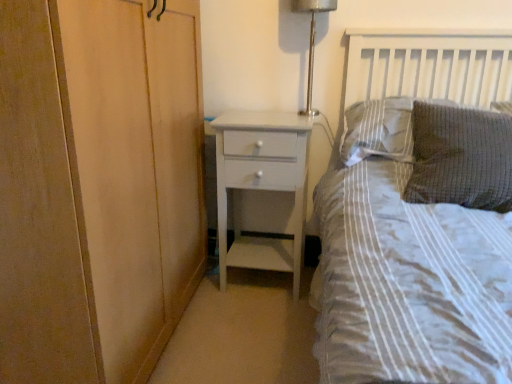
Identify the location of metallic silver lamp at upper right. The height and width of the screenshot is (384, 512). (312, 41).

Measure the distance between metallic silver lamp at upper right and camera.

metallic silver lamp at upper right and camera are 5.50 feet apart from each other.

Describe the element at coordinates (378, 130) in the screenshot. The width and height of the screenshot is (512, 384). I see `gray textured pillow at upper right, which is the first pillow from back to front` at that location.

Locate an element on the screen. metallic silver lamp at upper right is located at coordinates (312, 41).

Which is less distant, (308, 112) or (459, 153)?

Point (308, 112) is farther from the camera than point (459, 153).

Based on the photo, does metallic silver lamp at upper right come behind textured gray pillow at upper right, which is the first pillow in front-to-back order?

Yes, metallic silver lamp at upper right is behind textured gray pillow at upper right, which is the first pillow in front-to-back order.

Is metallic silver lamp at upper right facing away from textured gray pillow at upper right, which is the first pillow in front-to-back order?

No, metallic silver lamp at upper right is not facing away from textured gray pillow at upper right, which is the first pillow in front-to-back order.

Can you tell me how much metallic silver lamp at upper right and textured gray pillow at upper right, which is the first pillow in front-to-back order, differ in facing direction?

There is a 8.53-degree angle between the facing directions of metallic silver lamp at upper right and textured gray pillow at upper right, which is the first pillow in front-to-back order.

Is metallic silver lamp at upper right not close to gray textured pillow at upper right, marked as the 2th pillow in a front-to-back arrangement?

They are positioned close to each other.

Does point (307, 0) come farther from viewer compared to point (364, 106)?

Yes, point (307, 0) is behind point (364, 106).

In the scene shown: Is metallic silver lamp at upper right positioned with its back to gray textured pillow at upper right, which is the first pillow from back to front?

No, metallic silver lamp at upper right is not facing the opposite direction of gray textured pillow at upper right, which is the first pillow from back to front.

Is gray textured pillow at upper right, which is the first pillow from back to front, a part of metallic silver lamp at upper right?

No, gray textured pillow at upper right, which is the first pillow from back to front, is not inside metallic silver lamp at upper right.

Is gray textured pillow at upper right, which is the first pillow from back to front, inside or outside of metallic silver lamp at upper right?

gray textured pillow at upper right, which is the first pillow from back to front, lies outside metallic silver lamp at upper right.

From the image's perspective, is gray textured pillow at upper right, which is the first pillow from back to front, below metallic silver lamp at upper right?

Yes, from the image's perspective, gray textured pillow at upper right, which is the first pillow from back to front, is beneath metallic silver lamp at upper right.

Image resolution: width=512 pixels, height=384 pixels. I want to click on the 1st pillow below the metallic silver lamp at upper right (from a real-world perspective), so click(x=378, y=130).

From a real-world perspective, is white painted wood chest of drawers at center located higher than metallic silver lamp at upper right?

No, from a real-world perspective, white painted wood chest of drawers at center is not above metallic silver lamp at upper right.

Measure the distance between white painted wood chest of drawers at center and metallic silver lamp at upper right.

white painted wood chest of drawers at center is 17.68 inches away from metallic silver lamp at upper right.

Based on the photo, which object is thinner, white painted wood chest of drawers at center or metallic silver lamp at upper right?

metallic silver lamp at upper right.

Is white painted wood chest of drawers at center to the right of metallic silver lamp at upper right from the viewer's perspective?

No, white painted wood chest of drawers at center is not to the right of metallic silver lamp at upper right.

From the picture: Considering the positions of objects textured gray pillow at upper right, the second pillow from the back, and white painted wood chest of drawers at center in the image provided, who is more to the right, textured gray pillow at upper right, the second pillow from the back, or white painted wood chest of drawers at center?

textured gray pillow at upper right, the second pillow from the back, is more to the right.

In the scene shown: Can you confirm if textured gray pillow at upper right, the second pillow from the back, is shorter than white painted wood chest of drawers at center?

Yes.

From a real-world perspective, is textured gray pillow at upper right, which is the first pillow in front-to-back order, positioned over white painted wood chest of drawers at center based on gravity?

Yes, from a real-world perspective, textured gray pillow at upper right, which is the first pillow in front-to-back order, is above white painted wood chest of drawers at center.

Is textured gray pillow at upper right, which is the first pillow in front-to-back order, thinner than white painted wood chest of drawers at center?

No, textured gray pillow at upper right, which is the first pillow in front-to-back order, is not thinner than white painted wood chest of drawers at center.

Based on the photo, considering the sizes of objects white painted wood chest of drawers at center and gray textured pillow at upper right, which is the first pillow from back to front, in the image provided, who is taller, white painted wood chest of drawers at center or gray textured pillow at upper right, which is the first pillow from back to front,?

Standing taller between the two is white painted wood chest of drawers at center.

Is there a large distance between white painted wood chest of drawers at center and gray textured pillow at upper right, which is the first pillow from back to front?

white painted wood chest of drawers at center is actually quite close to gray textured pillow at upper right, which is the first pillow from back to front.

Locate an element on the screen. The height and width of the screenshot is (384, 512). chest of drawers located on the left of gray textured pillow at upper right, which is the first pillow from back to front is located at coordinates (261, 185).

Is gray textured pillow at upper right, marked as the 2th pillow in a front-to-back arrangement, a part of white painted wood chest of drawers at center?

That's incorrect, gray textured pillow at upper right, marked as the 2th pillow in a front-to-back arrangement, is not inside white painted wood chest of drawers at center.

Could you tell me if textured gray pillow at upper right, which is the first pillow in front-to-back order, is facing gray textured pillow at upper right, which is the first pillow from back to front?

No, textured gray pillow at upper right, which is the first pillow in front-to-back order, is not turned towards gray textured pillow at upper right, which is the first pillow from back to front.

Does textured gray pillow at upper right, which is the first pillow in front-to-back order, have a lesser width compared to gray textured pillow at upper right, marked as the 2th pillow in a front-to-back arrangement?

Incorrect, the width of textured gray pillow at upper right, which is the first pillow in front-to-back order, is not less than that of gray textured pillow at upper right, marked as the 2th pillow in a front-to-back arrangement.

Image resolution: width=512 pixels, height=384 pixels. I want to click on pillow on the left of the textured gray pillow at upper right, which is the first pillow in front-to-back order, so tap(378, 130).

At what (x,y) coordinates should I click in order to perform the action: click on bedside lamp above the textured gray pillow at upper right, the second pillow from the back (from the image's perspective). Please return your answer as a coordinate pair (x, y). This screenshot has height=384, width=512. Looking at the image, I should click on (312, 41).

Image resolution: width=512 pixels, height=384 pixels. I want to click on bedside lamp that is above the gray textured pillow at upper right, marked as the 2th pillow in a front-to-back arrangement (from a real-world perspective), so click(312, 41).

When comparing their distances from textured gray pillow at upper right, which is the first pillow in front-to-back order, does metallic silver lamp at upper right or white painted wood chest of drawers at center seem further?

metallic silver lamp at upper right.

From the image, which object appears to be nearer to textured gray pillow at upper right, the second pillow from the back, metallic silver lamp at upper right or gray textured pillow at upper right, marked as the 2th pillow in a front-to-back arrangement?

gray textured pillow at upper right, marked as the 2th pillow in a front-to-back arrangement, is positioned closer to the anchor textured gray pillow at upper right, the second pillow from the back.

From the image, which object appears to be farther from white painted wood chest of drawers at center, textured gray pillow at upper right, which is the first pillow in front-to-back order, or metallic silver lamp at upper right?

Based on the image, textured gray pillow at upper right, which is the first pillow in front-to-back order, appears to be further to white painted wood chest of drawers at center.

From the image, which object appears to be farther from gray textured pillow at upper right, marked as the 2th pillow in a front-to-back arrangement, white painted wood chest of drawers at center or textured gray pillow at upper right, which is the first pillow in front-to-back order?

white painted wood chest of drawers at center is positioned further to the anchor gray textured pillow at upper right, marked as the 2th pillow in a front-to-back arrangement.

Looking at the image, which one is located closer to white painted wood chest of drawers at center, gray textured pillow at upper right, which is the first pillow from back to front, or metallic silver lamp at upper right?

Based on the image, gray textured pillow at upper right, which is the first pillow from back to front, appears to be nearer to white painted wood chest of drawers at center.

When comparing their distances from textured gray pillow at upper right, the second pillow from the back, does gray textured pillow at upper right, marked as the 2th pillow in a front-to-back arrangement, or metallic silver lamp at upper right seem closer?

gray textured pillow at upper right, marked as the 2th pillow in a front-to-back arrangement, lies closer to textured gray pillow at upper right, the second pillow from the back, than the other object.

Based on their spatial positions, is white painted wood chest of drawers at center or textured gray pillow at upper right, the second pillow from the back, closer to metallic silver lamp at upper right?

The object closer to metallic silver lamp at upper right is white painted wood chest of drawers at center.

From the image, which object appears to be nearer to white painted wood chest of drawers at center, gray textured pillow at upper right, marked as the 2th pillow in a front-to-back arrangement, or textured gray pillow at upper right, which is the first pillow in front-to-back order?

Among the two, gray textured pillow at upper right, marked as the 2th pillow in a front-to-back arrangement, is located nearer to white painted wood chest of drawers at center.

Where is `pillow situated between white painted wood chest of drawers at center and textured gray pillow at upper right, the second pillow from the back, from left to right`? The image size is (512, 384). pillow situated between white painted wood chest of drawers at center and textured gray pillow at upper right, the second pillow from the back, from left to right is located at coordinates (378, 130).

Where is `pillow between metallic silver lamp at upper right and textured gray pillow at upper right, the second pillow from the back, from left to right`? The height and width of the screenshot is (384, 512). pillow between metallic silver lamp at upper right and textured gray pillow at upper right, the second pillow from the back, from left to right is located at coordinates (378, 130).

Where is `bedside lamp located between white painted wood chest of drawers at center and textured gray pillow at upper right, the second pillow from the back, in the left-right direction`? The width and height of the screenshot is (512, 384). bedside lamp located between white painted wood chest of drawers at center and textured gray pillow at upper right, the second pillow from the back, in the left-right direction is located at coordinates (312, 41).

This screenshot has width=512, height=384. I want to click on bedside lamp between white painted wood chest of drawers at center and gray textured pillow at upper right, marked as the 2th pillow in a front-to-back arrangement, from left to right, so click(x=312, y=41).